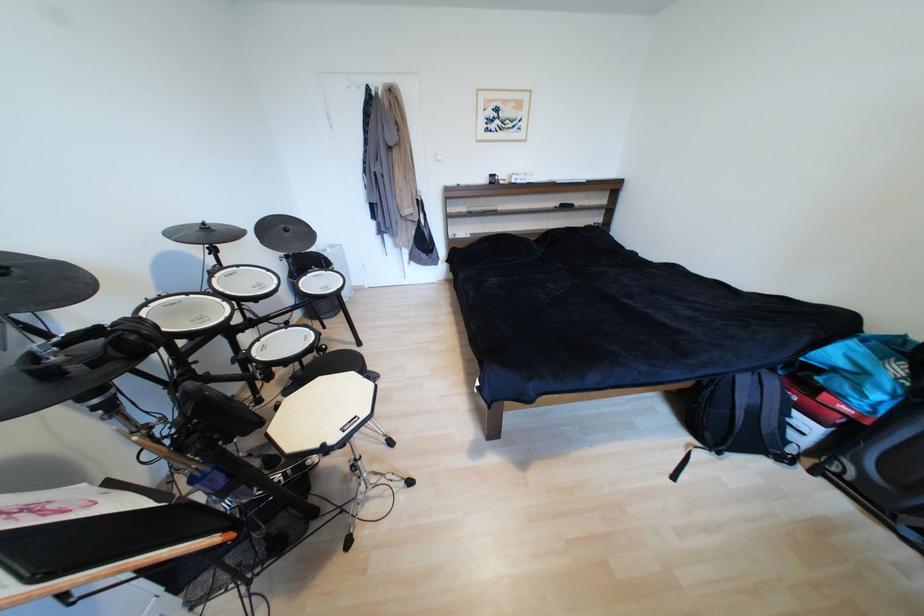
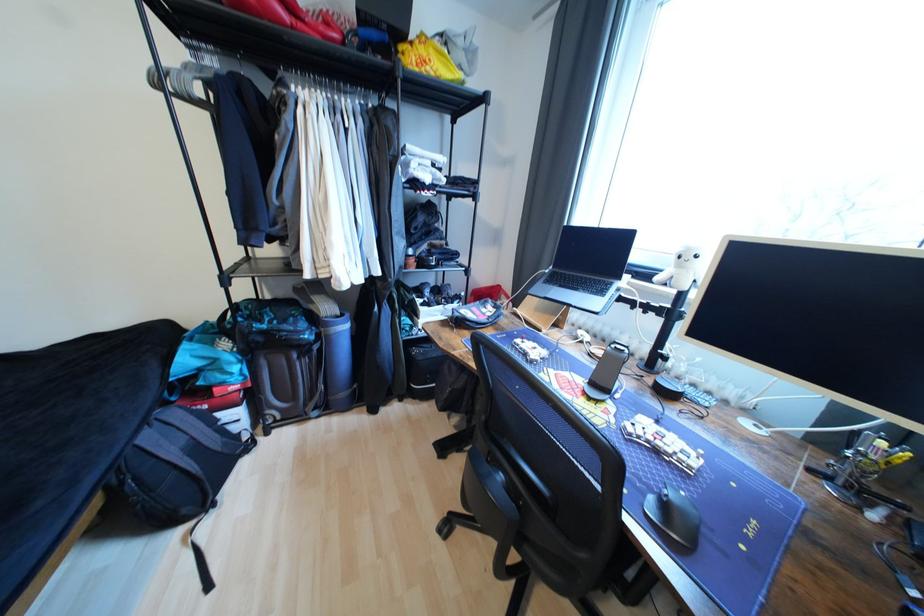
The point at (751, 381) is marked in the first image. Where is the corresponding point in the second image?

(155, 439)